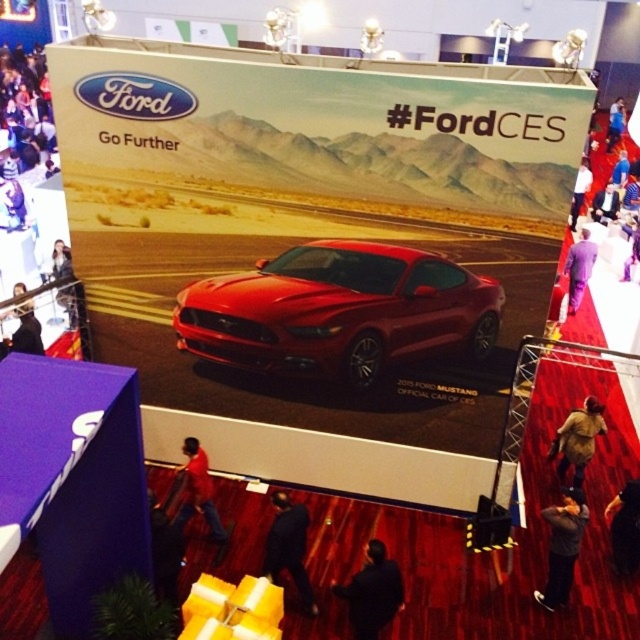
Question: Is purple fabric at right positioned behind blue denim jeans at upper right?

Choices:
 (A) no
 (B) yes

Answer: (A)

Question: Which point is farther to the camera?

Choices:
 (A) white fabric at upper center
 (B) blue denim jeans at upper right

Answer: (B)

Question: Does dark gray sweater at lower right appear under white fabric at upper center?

Choices:
 (A) yes
 (B) no

Answer: (A)

Question: Is the position of brown leather jacket at lower right more distant than that of purple fabric at right?

Choices:
 (A) no
 (B) yes

Answer: (A)

Question: Among these points, which one is nearest to the camera?

Choices:
 (A) (576, 550)
 (B) (593, 248)

Answer: (A)

Question: Considering the real-world distances, which object is closest to the purple fabric at right?

Choices:
 (A) dark gray sweater at lower right
 (B) dark blue suit at center
 (C) brown leather jacket at lower right

Answer: (C)